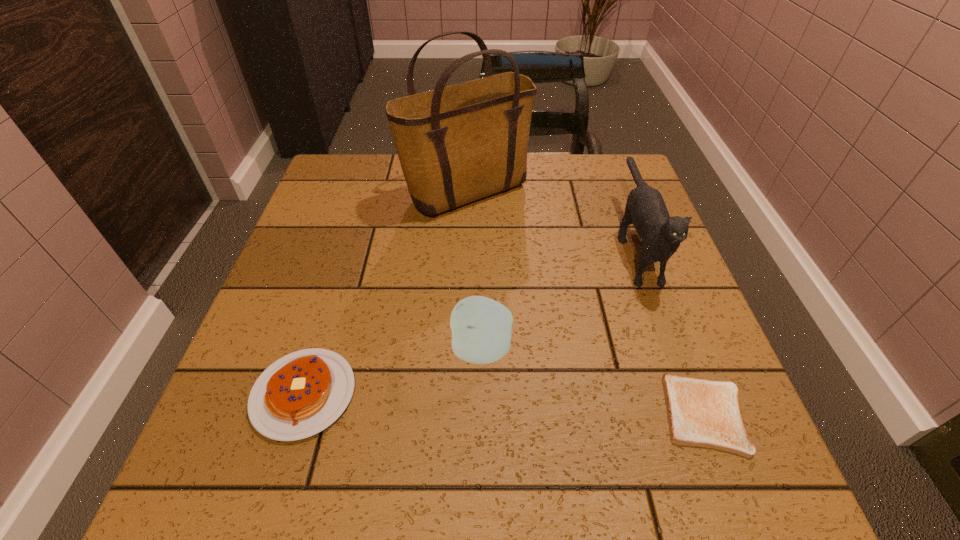
Identify the location of tote bag. (456, 144).

At what (x,y) coordinates should I click in order to perform the action: click on cat. Please return your answer as a coordinate pair (x, y). The image size is (960, 540). Looking at the image, I should click on (661, 235).

Image resolution: width=960 pixels, height=540 pixels. In order to click on apple in this screenshot , I will do `click(481, 328)`.

Locate an element on the screen. pancake is located at coordinates (299, 395).

Find the location of a particular element. The image size is (960, 540). the second shortest object is located at coordinates (299, 395).

Image resolution: width=960 pixels, height=540 pixels. I want to click on toast, so click(705, 413).

Locate an element on the screen. This screenshot has width=960, height=540. free space located on the front of the tallest object is located at coordinates (463, 309).

Identify the location of free spot located on the front-facing side of the cat. (705, 434).

You are a GUI agent. You are given a task and a screenshot of the screen. Output one action in this format:
    pyautogui.click(x=<x>, y=<y>)
    Task: Click on the free space located on the left of the third shortest object
    The width and height of the screenshot is (960, 540).
    Given the screenshot: What is the action you would take?
    pyautogui.click(x=300, y=349)

Locate an element on the screen. This screenshot has width=960, height=540. vacant space located 0.090m on the front of the second shortest object is located at coordinates (270, 506).